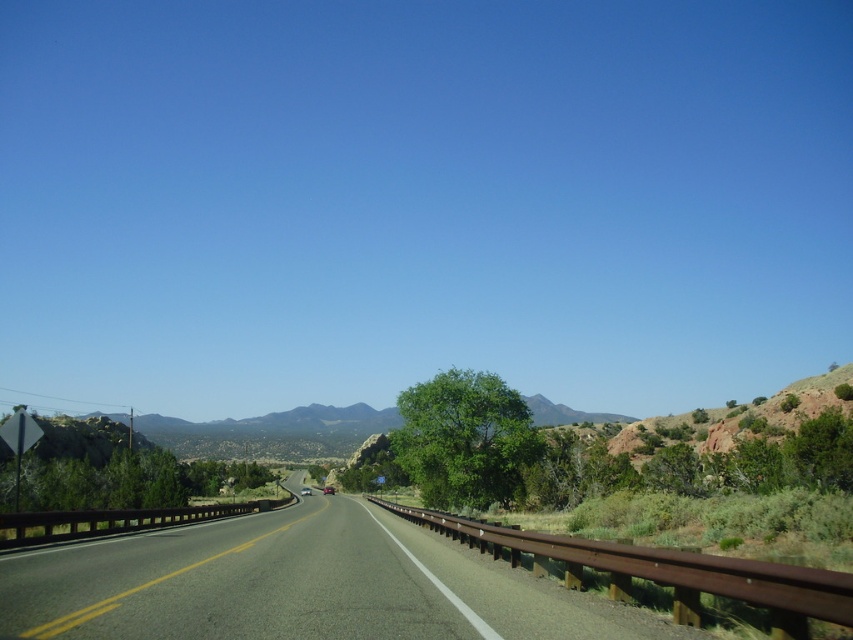
Question: Does asphalt road at center appear under metallic silver motorcycle at center?

Choices:
 (A) yes
 (B) no

Answer: (B)

Question: Does asphalt road at center have a lesser width compared to metallic silver motorcycle at center?

Choices:
 (A) no
 (B) yes

Answer: (A)

Question: Which point is farther from the camera taking this photo?

Choices:
 (A) (303, 488)
 (B) (404, 596)

Answer: (A)

Question: Which of the following is the closest to the observer?

Choices:
 (A) metallic silver motorcycle at center
 (B) asphalt road at center

Answer: (B)

Question: From the image, what is the correct spatial relationship of asphalt road at center in relation to metallic silver motorcycle at center?

Choices:
 (A) right
 (B) left

Answer: (A)

Question: Which of the following is the farthest from the observer?

Choices:
 (A) (518, 609)
 (B) (309, 490)

Answer: (B)